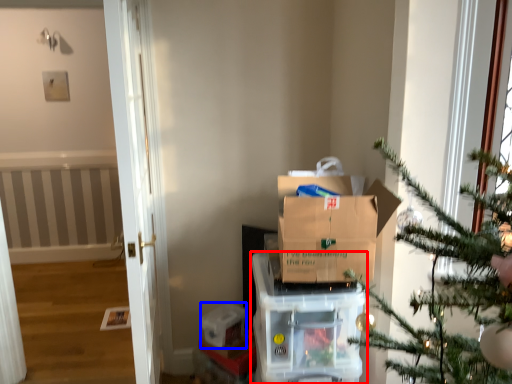
Question: Which of the following is the farthest to the observer, appliance (highlighted by a red box) or storage box (highlighted by a blue box)?

Choices:
 (A) appliance
 (B) storage box

Answer: (B)